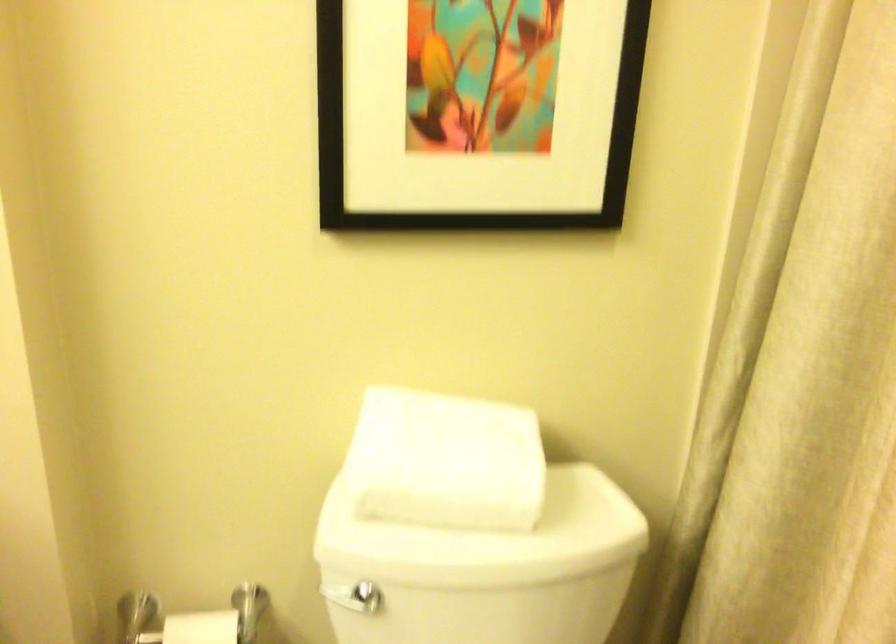
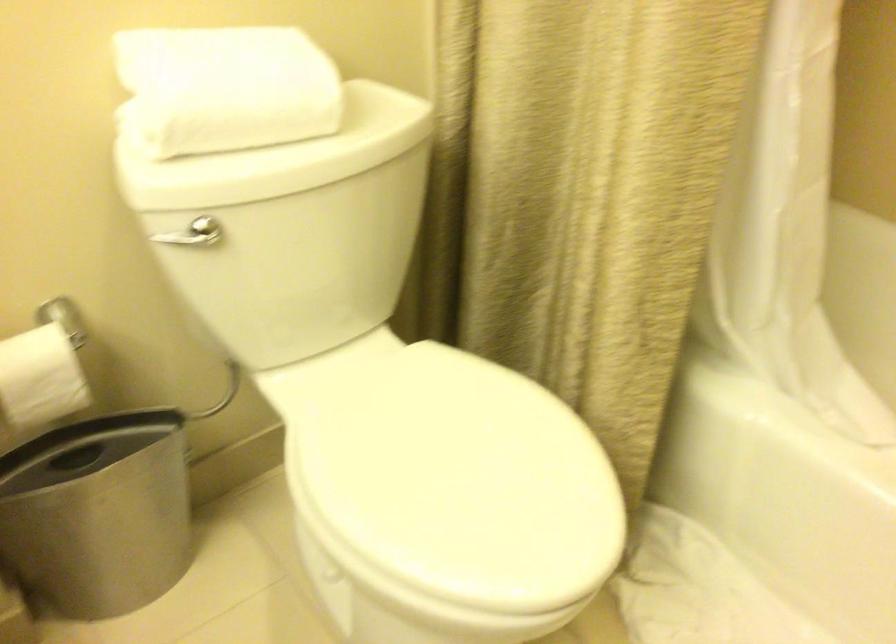
Locate, in the second image, the point that corresponds to (427,473) in the first image.

(225, 88)